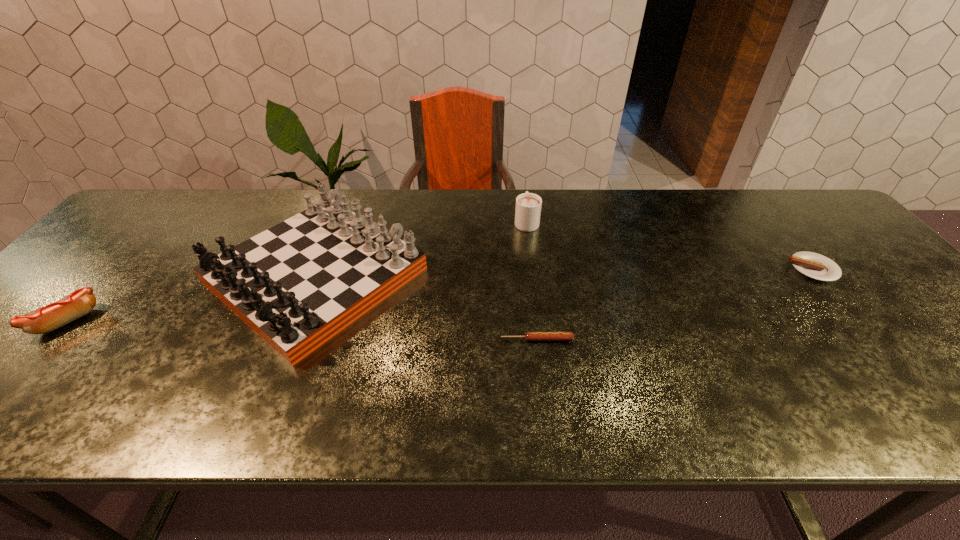
Image resolution: width=960 pixels, height=540 pixels. I want to click on gameboard, so click(x=297, y=284).

Locate an element on the screen. The height and width of the screenshot is (540, 960). the second object from left to right is located at coordinates (297, 284).

Image resolution: width=960 pixels, height=540 pixels. I want to click on the second tallest object, so click(528, 205).

You are a GUI agent. You are given a task and a screenshot of the screen. Output one action in this format:
    pyautogui.click(x=<x>, y=<y>)
    Task: Click on the leftmost object
    
    Given the screenshot: What is the action you would take?
    tap(77, 304)

You are a GUI agent. You are given a task and a screenshot of the screen. Output one action in this format:
    pyautogui.click(x=<x>, y=<y>)
    Task: Click on the leftmost sausage
    This screenshot has width=960, height=540.
    Given the screenshot: What is the action you would take?
    pyautogui.click(x=77, y=304)

Image resolution: width=960 pixels, height=540 pixels. I want to click on the rightmost object, so click(x=816, y=266).

Find the location of a particular element. The image size is (960, 540). the farthest sausage is located at coordinates (816, 266).

The height and width of the screenshot is (540, 960). What are the coordinates of `the shortest object` in the screenshot? It's located at (530, 336).

Find the location of a particular element. the second sausage from right to left is located at coordinates (530, 336).

At what (x,y) coordinates should I click in order to perform the action: click on vacant space situated 0.090m on the back of the gameboard. Please return your answer as a coordinate pair (x, y). The height and width of the screenshot is (540, 960). Looking at the image, I should click on (348, 196).